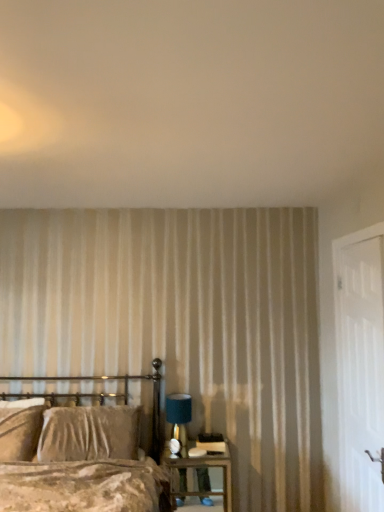
Question: Is white textured wall at upper center oriented towards velvet brown bed at lower left?

Choices:
 (A) no
 (B) yes

Answer: (A)

Question: Is white textured wall at upper center turned away from velvet brown bed at lower left?

Choices:
 (A) no
 (B) yes

Answer: (A)

Question: Can you confirm if white textured wall at upper center is thinner than velvet brown bed at lower left?

Choices:
 (A) yes
 (B) no

Answer: (B)

Question: Considering the relative positions of white textured wall at upper center and velvet brown bed at lower left in the image provided, is white textured wall at upper center to the left of velvet brown bed at lower left from the viewer's perspective?

Choices:
 (A) no
 (B) yes

Answer: (A)

Question: Is white textured wall at upper center wider than velvet brown bed at lower left?

Choices:
 (A) yes
 (B) no

Answer: (A)

Question: Considering the relative sizes of white textured wall at upper center and velvet brown bed at lower left in the image provided, is white textured wall at upper center taller than velvet brown bed at lower left?

Choices:
 (A) no
 (B) yes

Answer: (A)

Question: Would you say teal fabric lampshade at right is outside white textured wall at upper center?

Choices:
 (A) yes
 (B) no

Answer: (A)

Question: Does teal fabric lampshade at right appear on the left side of white textured wall at upper center?

Choices:
 (A) no
 (B) yes

Answer: (A)

Question: Does teal fabric lampshade at right have a greater height compared to white textured wall at upper center?

Choices:
 (A) no
 (B) yes

Answer: (B)

Question: Is teal fabric lampshade at right aimed at white textured wall at upper center?

Choices:
 (A) yes
 (B) no

Answer: (B)

Question: Is teal fabric lampshade at right next to white textured wall at upper center and touching it?

Choices:
 (A) no
 (B) yes

Answer: (A)

Question: Considering the relative sizes of teal fabric lampshade at right and white textured wall at upper center in the image provided, is teal fabric lampshade at right bigger than white textured wall at upper center?

Choices:
 (A) no
 (B) yes

Answer: (A)

Question: Is teal fabric lampshade at right facing away from wooden nightstand at lower right?

Choices:
 (A) yes
 (B) no

Answer: (B)